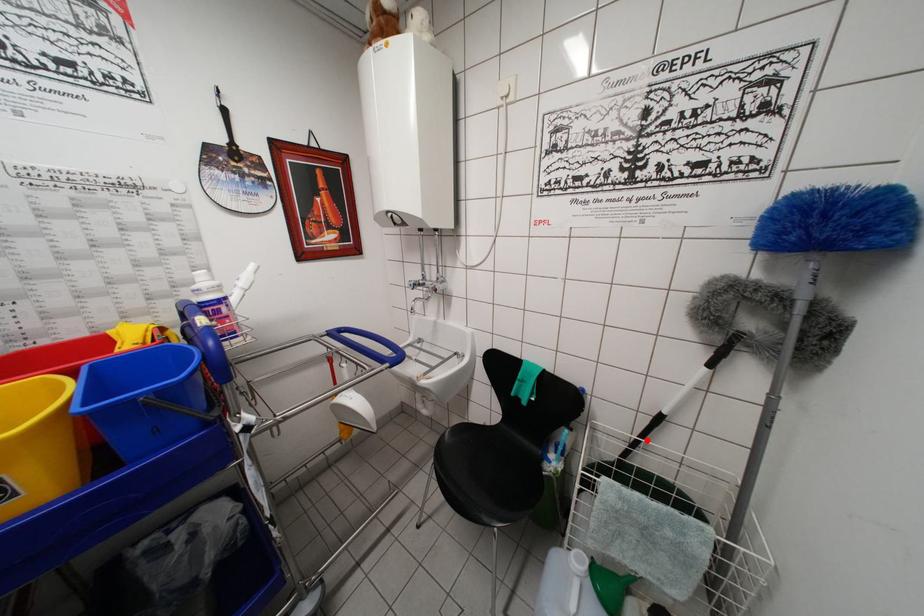
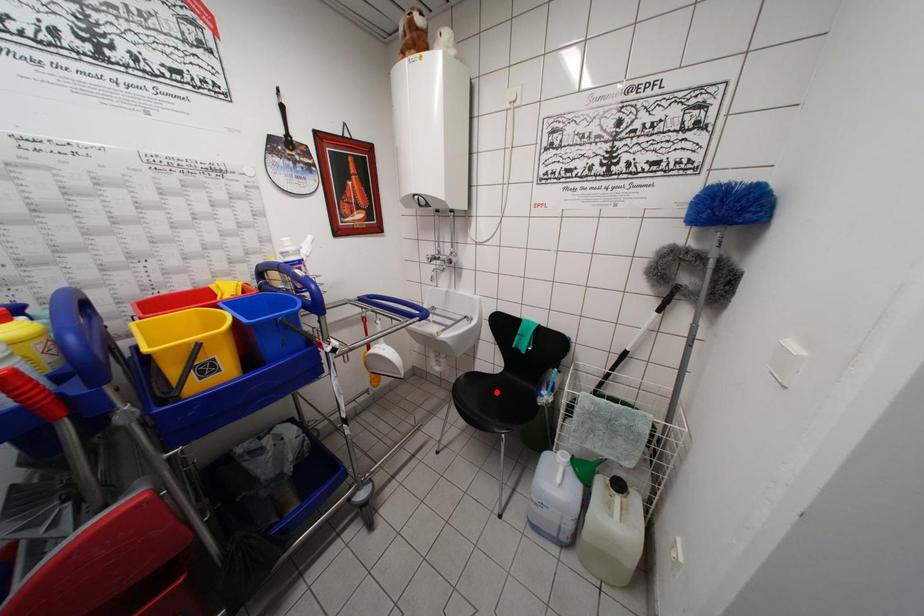
I am providing you with two images of the same scene from different viewpoints. A red point is marked on the first image and another point is marked on the second image. Is the marked point in image1 the same physical position as the marked point in image2?

No